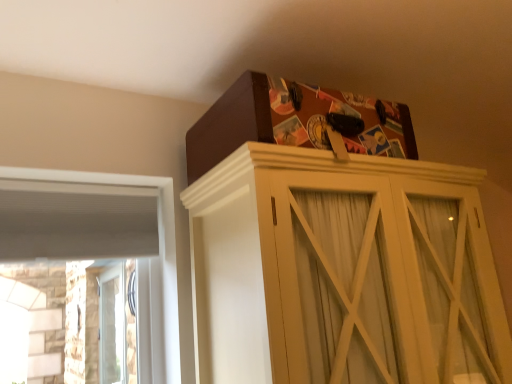
Question: Can you confirm if matte brown cabinet at upper center is wider than brown cardboard box at upper center?

Choices:
 (A) yes
 (B) no

Answer: (A)

Question: Is the position of matte brown cabinet at upper center more distant than that of brown cardboard box at upper center?

Choices:
 (A) yes
 (B) no

Answer: (B)

Question: Is matte brown cabinet at upper center to the right of brown cardboard box at upper center from the viewer's perspective?

Choices:
 (A) no
 (B) yes

Answer: (B)

Question: Can you confirm if matte brown cabinet at upper center is taller than brown cardboard box at upper center?

Choices:
 (A) yes
 (B) no

Answer: (A)

Question: Is the position of matte brown cabinet at upper center less distant than that of brown cardboard box at upper center?

Choices:
 (A) no
 (B) yes

Answer: (B)

Question: From a real-world perspective, is matte brown cabinet at upper center physically located above or below white wood frame at left?

Choices:
 (A) above
 (B) below

Answer: (B)

Question: Considering the positions of matte brown cabinet at upper center and white wood frame at left in the image, is matte brown cabinet at upper center wider or thinner than white wood frame at left?

Choices:
 (A) thin
 (B) wide

Answer: (B)

Question: From the image's perspective, is matte brown cabinet at upper center above or below white wood frame at left?

Choices:
 (A) below
 (B) above

Answer: (B)

Question: In terms of size, does matte brown cabinet at upper center appear bigger or smaller than white wood frame at left?

Choices:
 (A) big
 (B) small

Answer: (A)

Question: From the image's perspective, is brown cardboard box at upper center above or below white wood frame at left?

Choices:
 (A) above
 (B) below

Answer: (A)

Question: Choose the correct answer: Is brown cardboard box at upper center inside white wood frame at left or outside it?

Choices:
 (A) outside
 (B) inside

Answer: (A)

Question: Would you say brown cardboard box at upper center is to the left or to the right of white wood frame at left in the picture?

Choices:
 (A) left
 (B) right

Answer: (B)

Question: From a real-world perspective, is brown cardboard box at upper center above or below white wood frame at left?

Choices:
 (A) below
 (B) above

Answer: (B)

Question: Is point (163, 253) closer or farther from the camera than point (458, 225)?

Choices:
 (A) farther
 (B) closer

Answer: (A)

Question: Do you think white wood frame at left is within matte brown cabinet at upper center, or outside of it?

Choices:
 (A) outside
 (B) inside

Answer: (A)